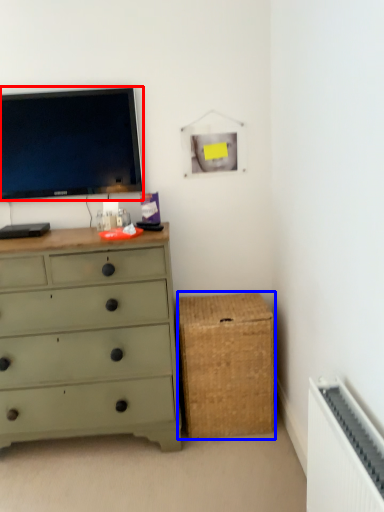
Question: Which of the following is the closest to the observer, television (highlighted by a red box) or storage box (highlighted by a blue box)?

Choices:
 (A) television
 (B) storage box

Answer: (A)